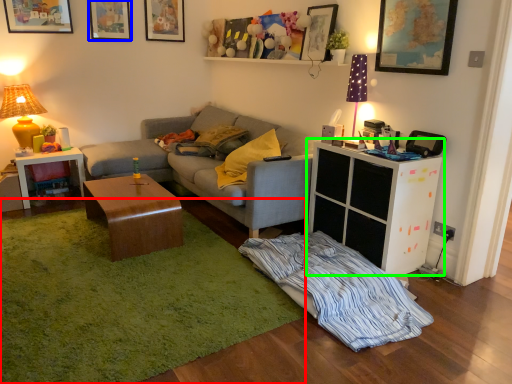
Question: Based on their relative distances, which object is nearer to plain (highlighted by a red box)? Choose from picture frame (highlighted by a blue box) and cabinetry (highlighted by a green box).

Choices:
 (A) picture frame
 (B) cabinetry

Answer: (B)